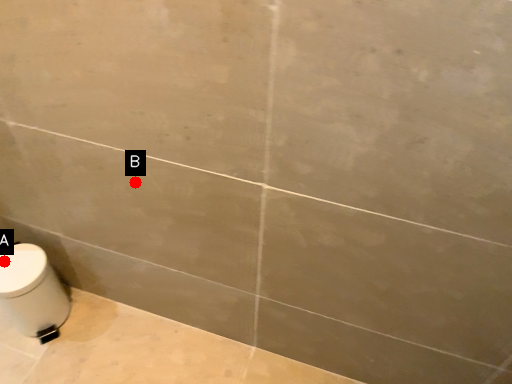
Question: Two points are circled on the image, labeled by A and B beside each circle. Which point appears closest to the camera in this image?

Choices:
 (A) A is closer
 (B) B is closer

Answer: (B)